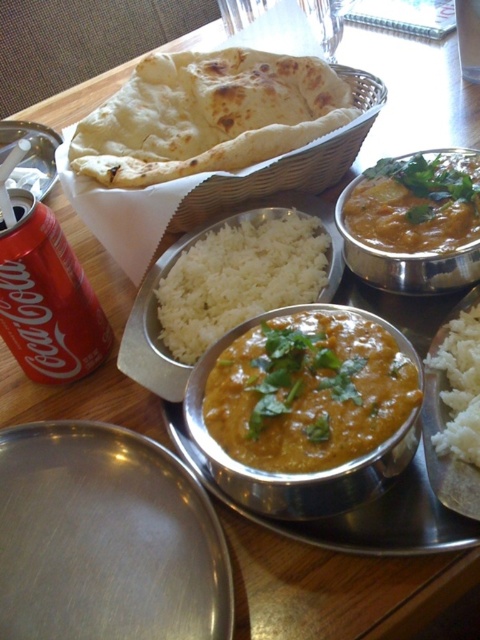
Question: Is white matte rice at center wider than yellow-orange creamy curry at center?

Choices:
 (A) no
 (B) yes

Answer: (B)

Question: Which point is farther to the camera?

Choices:
 (A) (215, 422)
 (B) (107, 161)
 (C) (471, 68)
 (D) (46, 246)

Answer: (C)

Question: Can you confirm if white matte rice at center is positioned to the left of clear glass beverage at upper center?

Choices:
 (A) yes
 (B) no

Answer: (A)

Question: Which object is farther from the camera taking this photo?

Choices:
 (A) white fluffy rice at center
 (B) clear glass beverage at upper center
 (C) red matte can at left
 (D) white matte rice at center

Answer: (B)

Question: Does golden brown flatbread at center come behind red matte can at left?

Choices:
 (A) yes
 (B) no

Answer: (A)

Question: Which object is closer to the camera taking this photo?

Choices:
 (A) white matte rice at center
 (B) white fluffy rice at center
 (C) golden brown flatbread at center

Answer: (B)